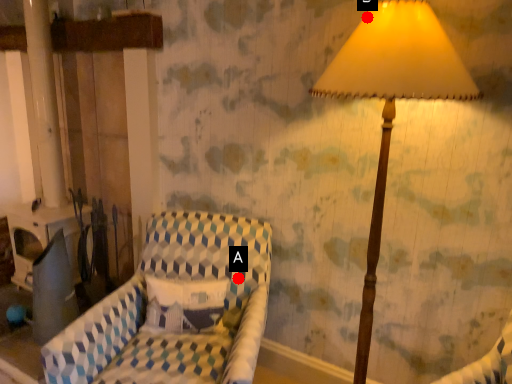
Question: Two points are circled on the image, labeled by A and B beside each circle. Among these points, which one is farthest from the camera?

Choices:
 (A) A is further
 (B) B is further

Answer: (A)